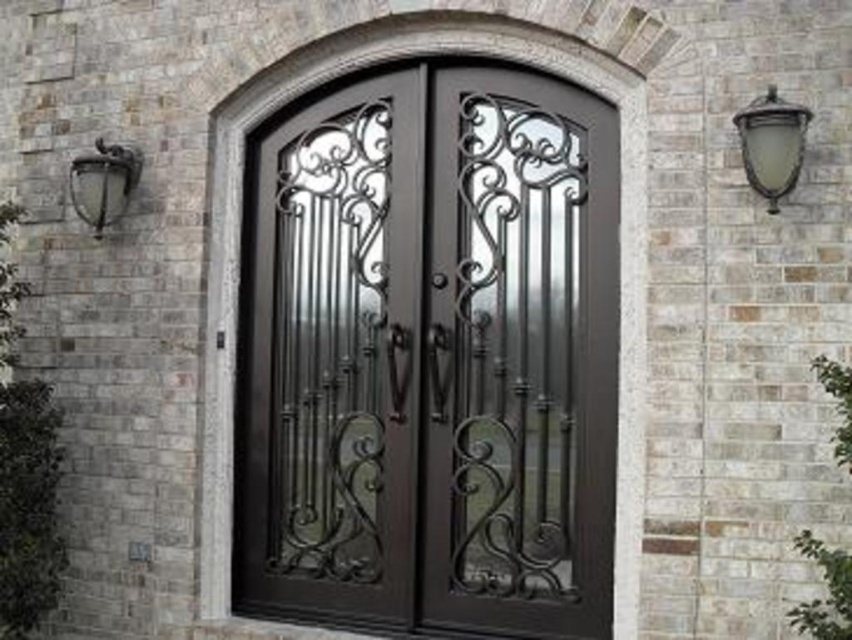
Is the position of dark brown wrought iron door at center less distant than that of metallic wrought iron lamp at left?

That is True.

Based on the photo, who is taller, dark brown wrought iron door at center or metallic wrought iron lamp at left?

dark brown wrought iron door at center

Is point (409, 241) closer to viewer compared to point (101, 195)?

Yes.

At what (x,y) coordinates should I click in order to perform the action: click on dark brown wrought iron door at center. Please return your answer as a coordinate pair (x, y). Looking at the image, I should click on (332, 358).

Between point (315, 589) and point (93, 166), which one is positioned behind?

The point (93, 166) is behind.

Does dark brown wrought iron at center have a greater width compared to metallic wrought iron lamp at left?

Correct, the width of dark brown wrought iron at center exceeds that of metallic wrought iron lamp at left.

Is point (456, 310) behind point (87, 214)?

That is False.

I want to click on dark brown wrought iron at center, so pyautogui.click(x=430, y=356).

Is point (327, 595) farther from camera compared to point (783, 150)?

That is True.

Can you confirm if dark brown wrought iron door at center is positioned to the right of matte glass lamp at upper right?

No, dark brown wrought iron door at center is not to the right of matte glass lamp at upper right.

Which is behind, point (389, 458) or point (783, 157)?

Point (389, 458)

Locate an element on the screen. The height and width of the screenshot is (640, 852). dark brown wrought iron door at center is located at coordinates (332, 358).